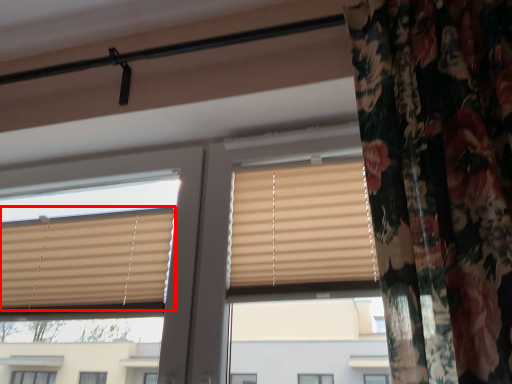
Question: Where is window blind (annotated by the red box) located in relation to window in the image?

Choices:
 (A) left
 (B) right

Answer: (A)